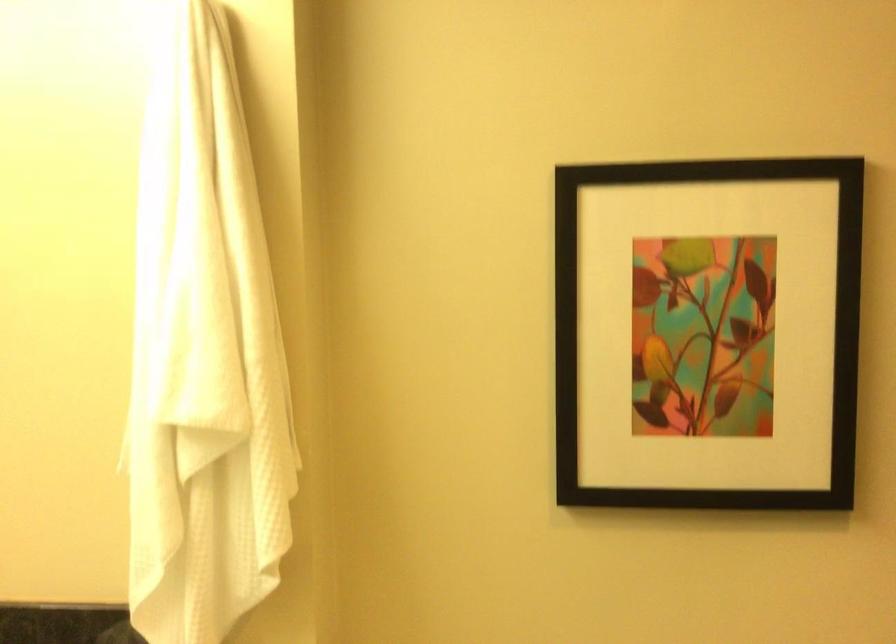
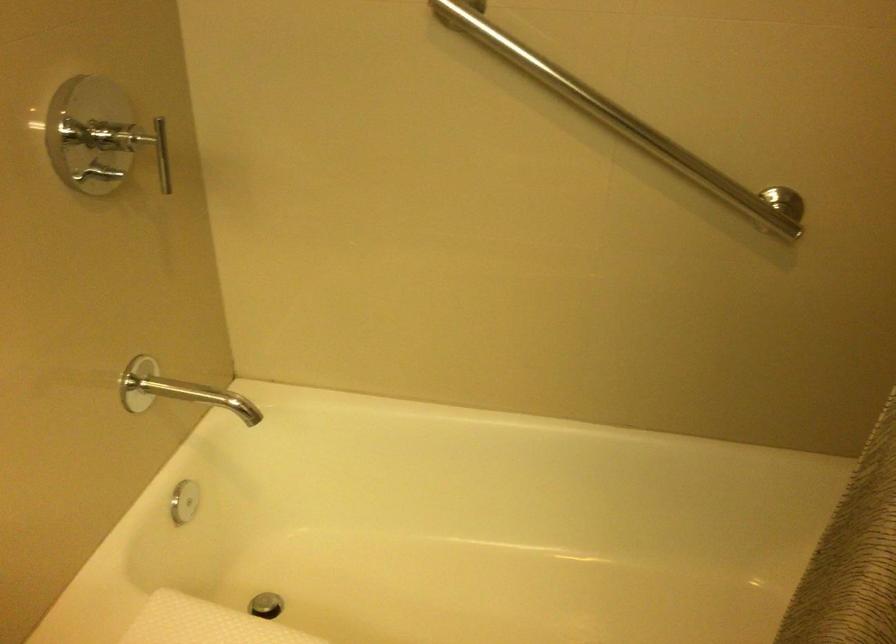
How did the camera likely rotate?

The camera's rotation is toward right-down.